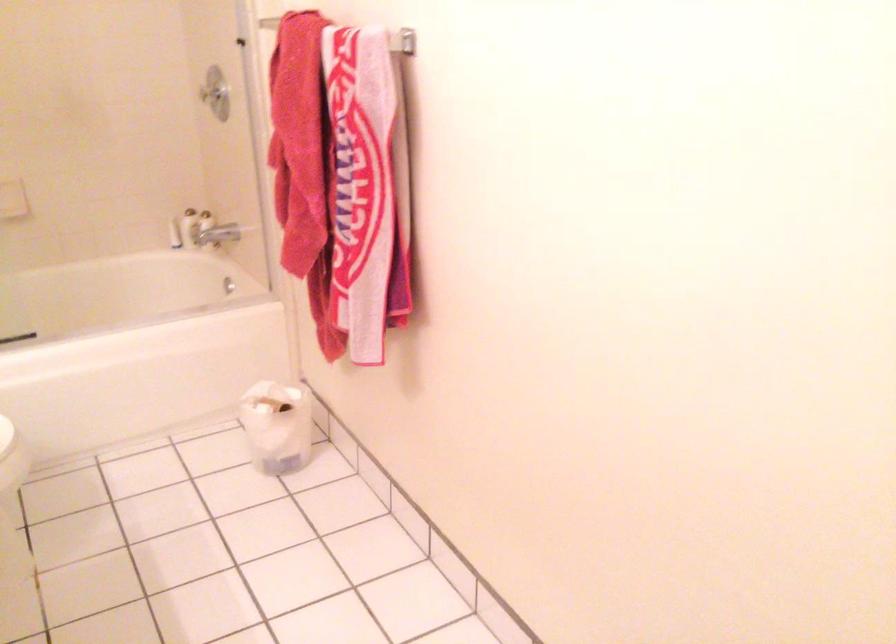
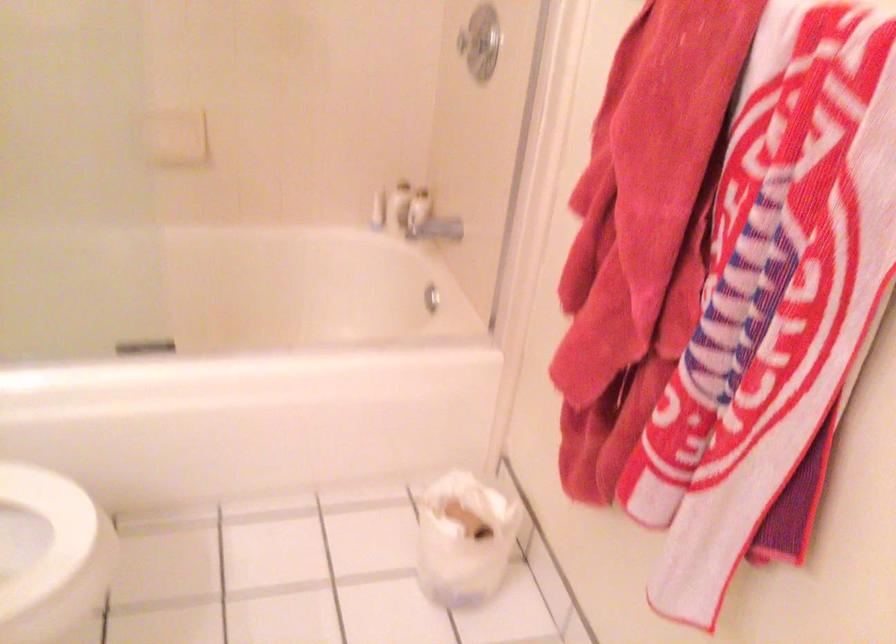
Question: The images are taken continuously from a first-person perspective. In which direction is your viewpoint rotating?

Choices:
 (A) Left
 (B) Right
 (C) Up
 (D) Down

Answer: (A)